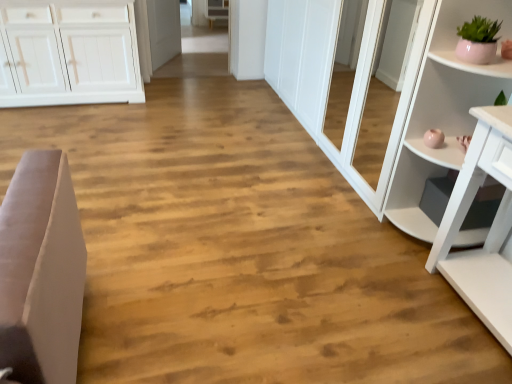
You are a GUI agent. You are given a task and a screenshot of the screen. Output one action in this format:
    pyautogui.click(x=<x>, y=<y>)
    Task: Click on the free point in front of white glossy shelf at right
    
    Given the screenshot: What is the action you would take?
    pyautogui.click(x=431, y=306)